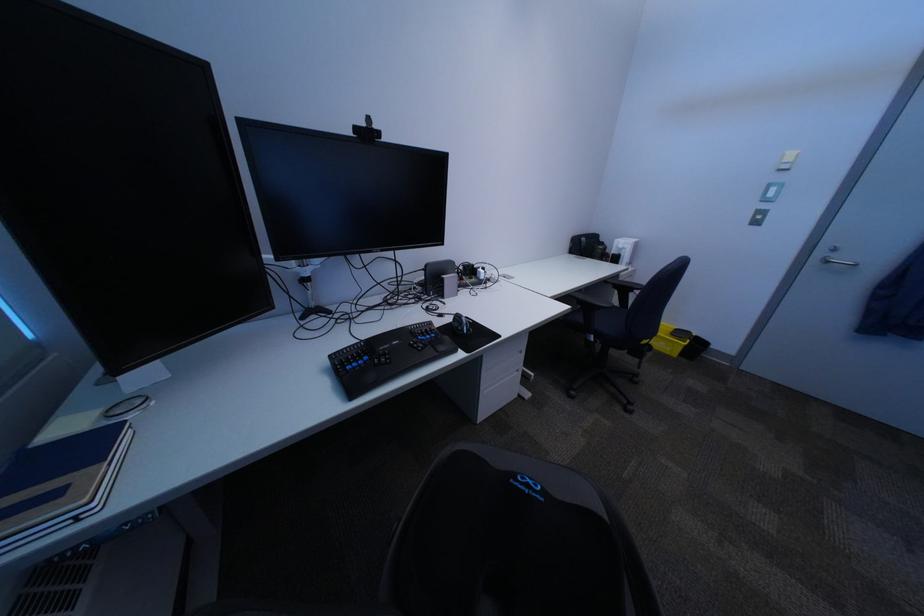
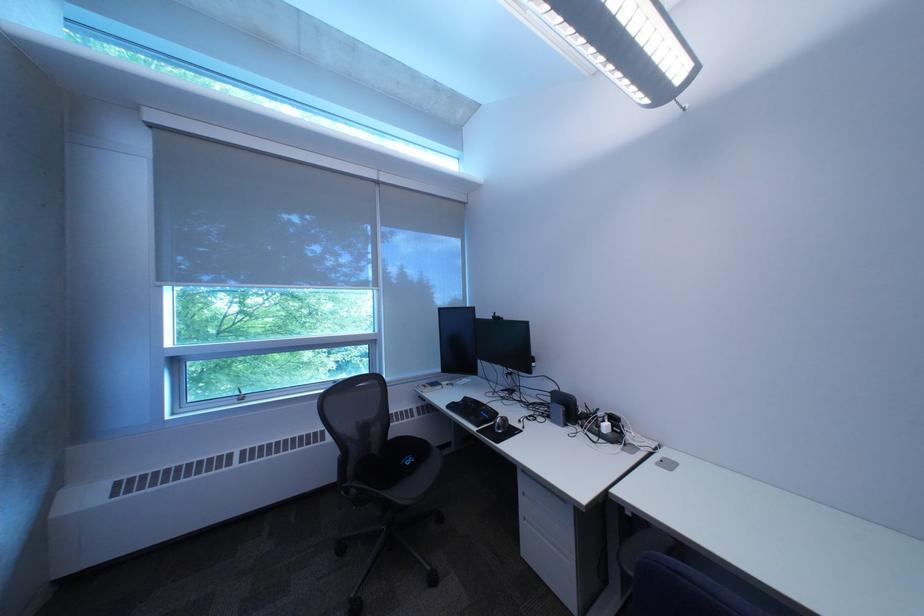
In the second image, find the point that corresponds to point 394,285 in the first image.

(532, 387)